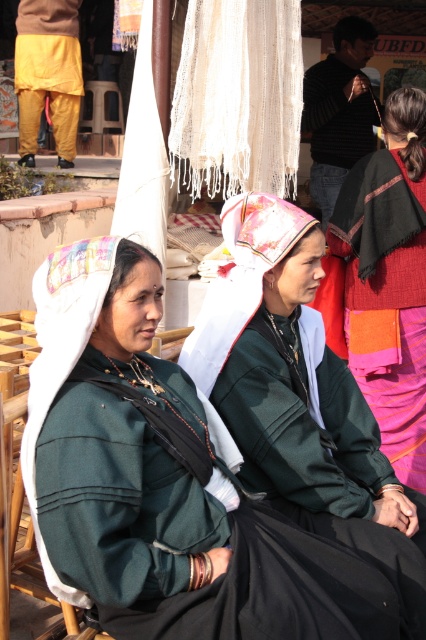
Between green matte jacket at center and white woven cloth at upper center, which one has less height?

With less height is green matte jacket at center.

Where is `green matte jacket at center`? green matte jacket at center is located at coordinates pyautogui.click(x=319, y=458).

What are the coordinates of `green matte jacket at center` in the screenshot? It's located at pos(319,458).

Which is more to the right, white woven cloth at upper center or yellow cotton pants at left?

From the viewer's perspective, white woven cloth at upper center appears more on the right side.

Is point (238, 88) closer to viewer compared to point (51, 115)?

That is True.

I want to click on white woven cloth at upper center, so click(238, 97).

Consider the image. Can you confirm if orange cotton sari at right is positioned to the left of green fabric chair at lower left?

Incorrect, orange cotton sari at right is not on the left side of green fabric chair at lower left.

Can you confirm if orange cotton sari at right is thinner than green fabric chair at lower left?

No, orange cotton sari at right is not thinner than green fabric chair at lower left.

Is point (394, 397) positioned before point (23, 394)?

That is False.

You are a GUI agent. You are given a task and a screenshot of the screen. Output one action in this format:
    pyautogui.click(x=<x>, y=<y>)
    Task: Click on the orange cotton sari at right
    This screenshot has width=426, height=640.
    Given the screenshot: What is the action you would take?
    pyautogui.click(x=388, y=280)